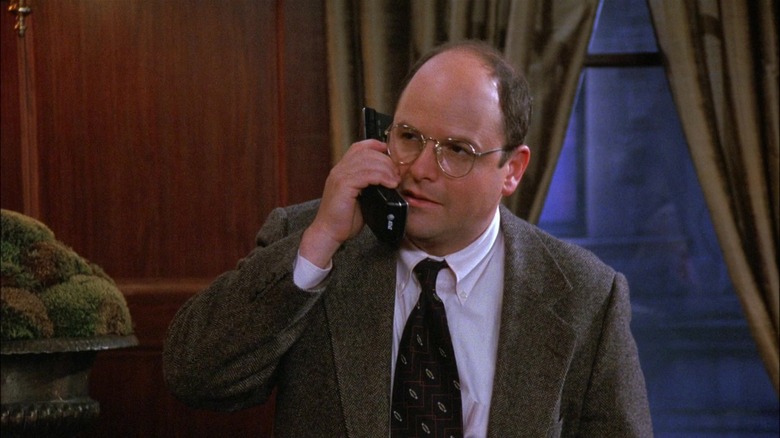
In order to click on wall in this screenshot , I will do `click(133, 159)`.